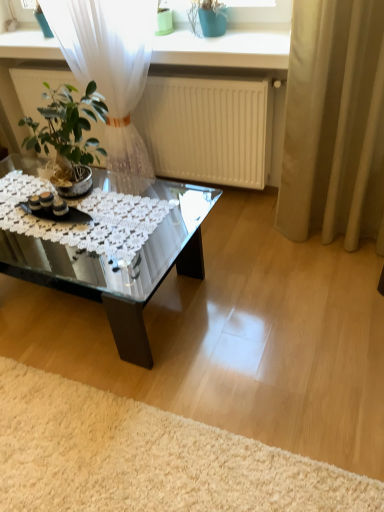
Question: Do you think white shaggy rug at lower left is within white matte radiator at upper center, or outside of it?

Choices:
 (A) inside
 (B) outside

Answer: (B)

Question: Is point (162, 493) closer or farther from the camera than point (198, 144)?

Choices:
 (A) farther
 (B) closer

Answer: (B)

Question: Which object is positioned farthest from the beige fabric curtain at right?

Choices:
 (A) white matte radiator at upper center
 (B) transparent glass coffee table at center
 (C) white shaggy rug at lower left

Answer: (C)

Question: Based on their relative distances, which object is farther from the transparent glass coffee table at center?

Choices:
 (A) white shaggy rug at lower left
 (B) white matte radiator at upper center
 (C) beige fabric curtain at right

Answer: (C)